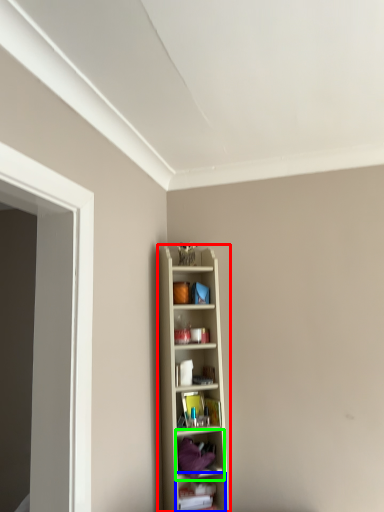
Question: Which object is the farthest from shelf (highlighted by a red box)? Choose among these: shelf (highlighted by a blue box) or shelf (highlighted by a green box).

Choices:
 (A) shelf
 (B) shelf

Answer: (A)